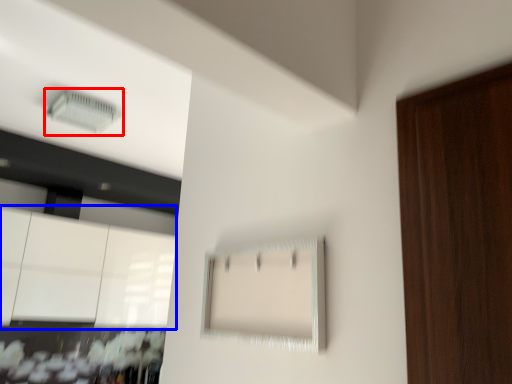
Question: Which point is further to the camera, air conditioning (highlighted by a red box) or cabinetry (highlighted by a blue box)?

Choices:
 (A) air conditioning
 (B) cabinetry

Answer: (B)